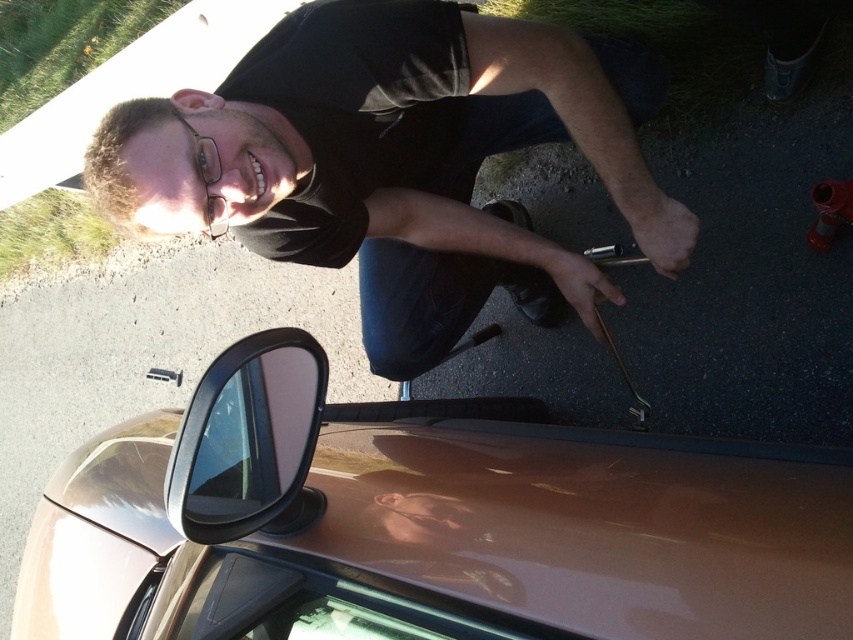
You are standing at the origin point of the coordinate system, which is the bottom left corner of the image. The coordinates provided are in the format of x and y values between 0 and 1. If the glossy metallic car at lower center is represented by point (476, 532), can you determine its position relative to the origin?

The glossy metallic car at lower center is located at coordinates (476, 532). Since the origin is the bottom left corner, the x value of 0.833 indicates it is 83.3 percent of the way to the right edge, and the y value of 0.559 means it is 55.9 percent up from the bottom. This places it towards the lower center area of the image.

You are standing in front of the car and notice the black matte shirt at upper center and the glossy black side mirror at lower left. Which object is located higher in the image?

The black matte shirt at upper center is positioned over the glossy black side mirror at lower left, so it is higher in the image.

You are standing at the point labeled point [50,515]. You want to reach the car engine to fix a leak. The engine is located 5.48 feet away from your current position. If you can move in a straight line towards the engine, will you have enough space to crawl under the car to access the engine without hitting your head? The ground under the car has a clearance of 10 inches.

The distance between you and the engine is 5.48 feet. Since the ground clearance under the car is 10 inches, which is less than the average adult height when crawling, you might hit your head. It is recommended to use a jack to lift the car for safer access.